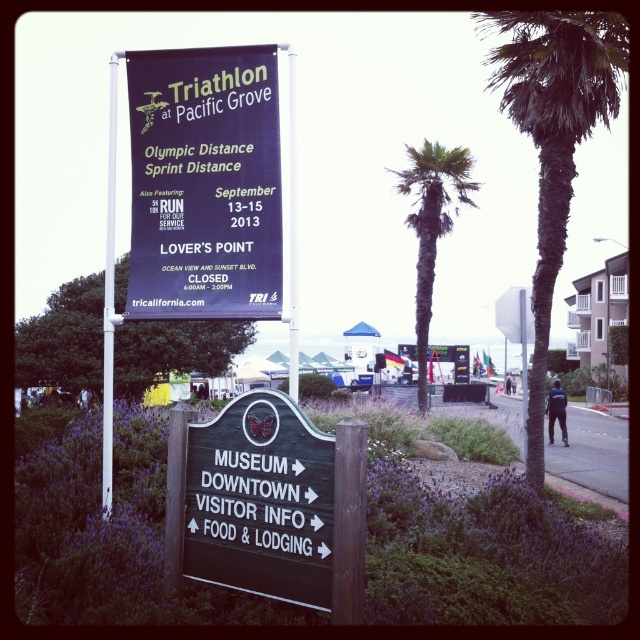
Question: Which of these objects is positioned closest to the green leafy palm tree at right?

Choices:
 (A) green leafy palm tree at center
 (B) dark purple banner at center

Answer: (B)

Question: In this image, where is dark purple banner at center located relative to white plastic pole at upper center?

Choices:
 (A) below
 (B) above

Answer: (B)

Question: Which point appears farthest from the camera in this image?

Choices:
 (A) (426, 193)
 (B) (547, 340)

Answer: (A)

Question: Is green leafy palm tree at right smaller than white plastic pole at upper left?

Choices:
 (A) no
 (B) yes

Answer: (B)

Question: Considering the real-world distances, which object is farthest from the white plastic pole at upper left?

Choices:
 (A) white plastic pole at upper center
 (B) dark purple banner at center

Answer: (A)

Question: Is green leafy palm tree at right positioned in front of green leafy palm tree at center?

Choices:
 (A) no
 (B) yes

Answer: (B)